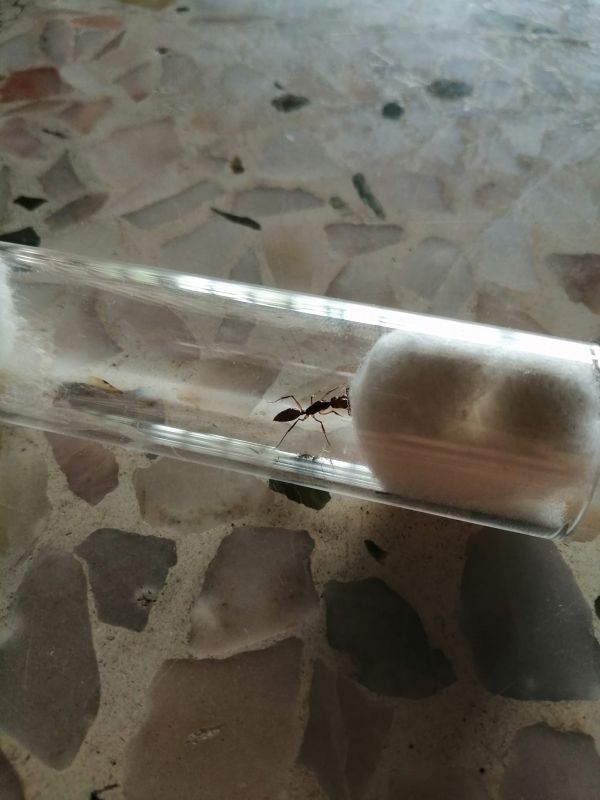
The image size is (600, 800). Identify the location of table. (371, 160).